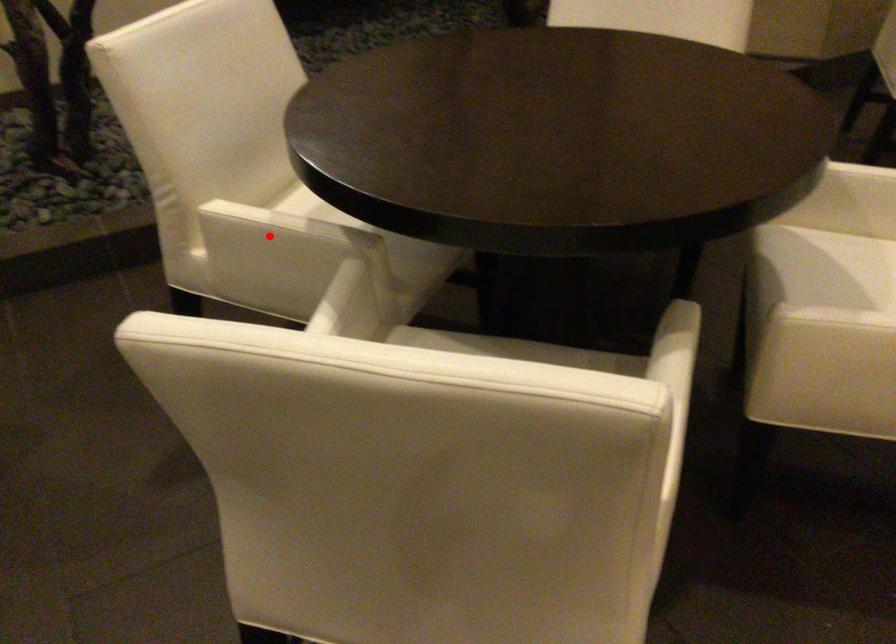
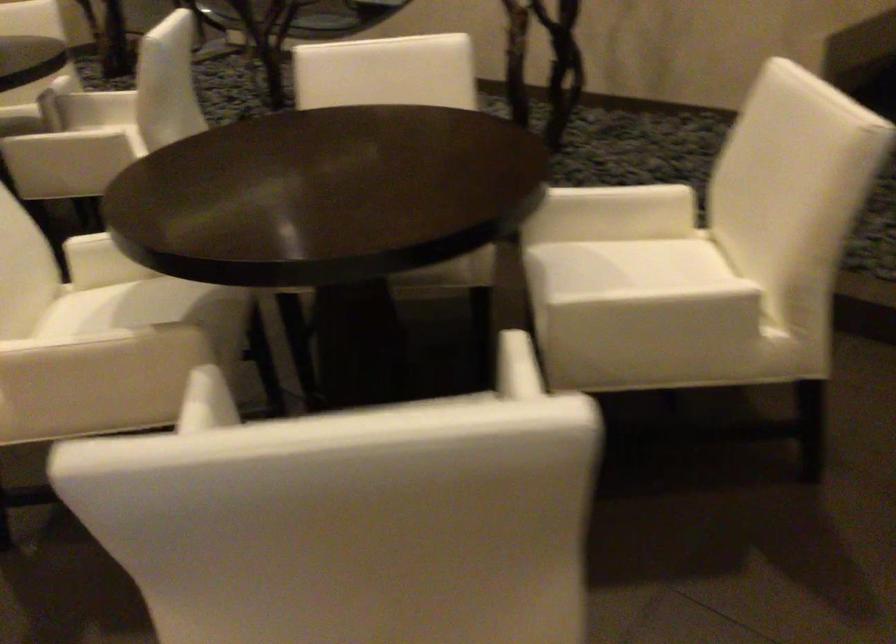
Question: I am providing you with two images of the same scene from different viewpoints. A red point is marked on the first image. Can you still see the location of the red point in image 2?

Choices:
 (A) Yes
 (B) No

Answer: (B)